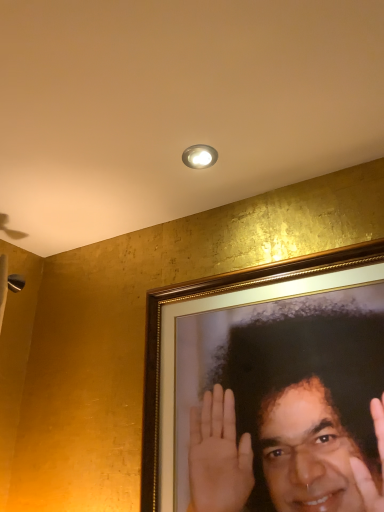
Question: Is matte silver light fixture at upper center turned away from smooth gold frame at upper right?

Choices:
 (A) yes
 (B) no

Answer: (B)

Question: Is matte silver light fixture at upper center in contact with smooth gold frame at upper right?

Choices:
 (A) yes
 (B) no

Answer: (B)

Question: Can we say matte silver light fixture at upper center lies outside smooth gold frame at upper right?

Choices:
 (A) yes
 (B) no

Answer: (A)

Question: Does matte silver light fixture at upper center have a lesser width compared to smooth gold frame at upper right?

Choices:
 (A) no
 (B) yes

Answer: (A)

Question: Can smooth gold frame at upper right be found inside matte silver light fixture at upper center?

Choices:
 (A) yes
 (B) no

Answer: (B)

Question: Considering the relative positions of matte silver light fixture at upper center and smooth gold frame at upper right in the image provided, is matte silver light fixture at upper center behind smooth gold frame at upper right?

Choices:
 (A) no
 (B) yes

Answer: (B)

Question: Would you say smooth gold frame at upper right is a long distance from matte silver light fixture at upper center?

Choices:
 (A) yes
 (B) no

Answer: (B)

Question: Does smooth gold frame at upper right have a larger size compared to matte silver light fixture at upper center?

Choices:
 (A) yes
 (B) no

Answer: (A)

Question: Is smooth gold frame at upper right next to matte silver light fixture at upper center?

Choices:
 (A) no
 (B) yes

Answer: (A)

Question: Could matte silver light fixture at upper center be considered to be inside smooth gold frame at upper right?

Choices:
 (A) no
 (B) yes

Answer: (A)

Question: From a real-world perspective, is smooth gold frame at upper right physically below matte silver light fixture at upper center?

Choices:
 (A) no
 (B) yes

Answer: (B)

Question: Is smooth gold frame at upper right positioned before matte silver light fixture at upper center?

Choices:
 (A) no
 (B) yes

Answer: (B)

Question: Considering the positions of matte silver light fixture at upper center and smooth gold frame at upper right in the image, is matte silver light fixture at upper center taller or shorter than smooth gold frame at upper right?

Choices:
 (A) short
 (B) tall

Answer: (A)